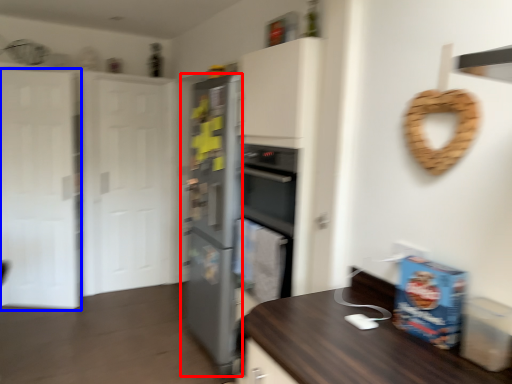
Question: Which of the following is the closest to the observer, refrigerator (highlighted by a red box) or glass door (highlighted by a blue box)?

Choices:
 (A) refrigerator
 (B) glass door

Answer: (A)